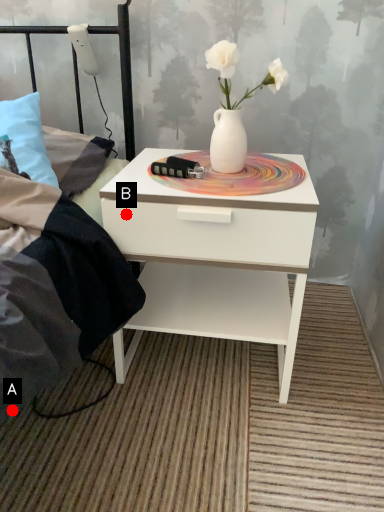
Question: Two points are circled on the image, labeled by A and B beside each circle. Which of the following is the closest to the observer?

Choices:
 (A) A is closer
 (B) B is closer

Answer: (A)